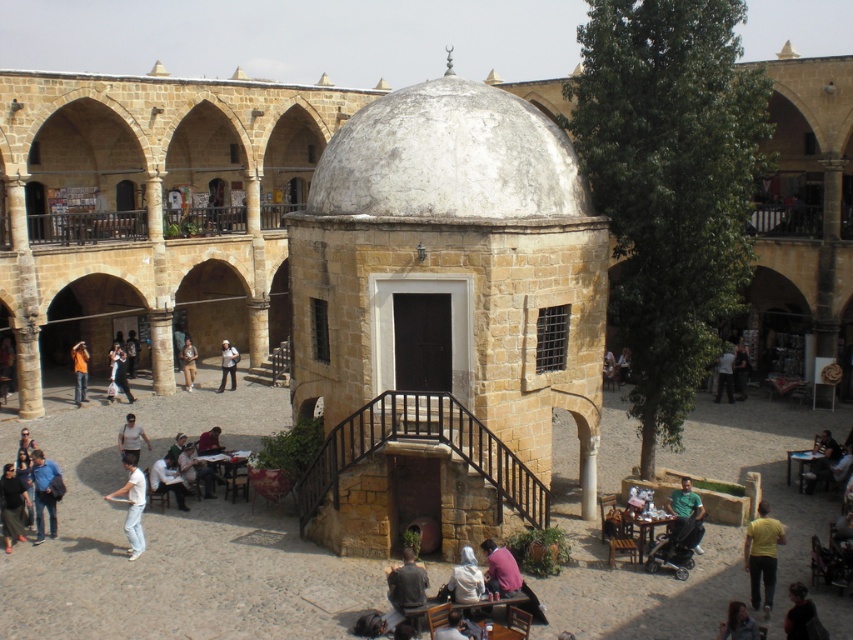
Does yellow matte shirt at lower right appear on the left side of dark gray leather jacket at center?

Incorrect, yellow matte shirt at lower right is not on the left side of dark gray leather jacket at center.

Is point (764, 602) in front of point (415, 563)?

Yes.

Who is more distant from viewer, (775, 570) or (395, 600)?

The point (775, 570) is more distant.

Locate an element on the screen. Image resolution: width=853 pixels, height=640 pixels. yellow matte shirt at lower right is located at coordinates (762, 556).

Consider the image. Measure the distance between dark blue jeans at lower left and dark brown fur coat at lower right.

The distance of dark blue jeans at lower left from dark brown fur coat at lower right is 104.31 feet.

Which is below, dark blue jeans at lower left or dark brown fur coat at lower right?

dark brown fur coat at lower right

Who is more distant from viewer, [4,536] or [799,611]?

Positioned behind is point [4,536].

Where is `dark blue jeans at lower left`? The width and height of the screenshot is (853, 640). dark blue jeans at lower left is located at coordinates (10, 506).

Is point (492, 572) positioned in front of point (227, 358)?

Yes, it is.

Does pink fabric shirt at lower center have a lesser height compared to white fabric shirt at center?

Yes, pink fabric shirt at lower center is shorter than white fabric shirt at center.

I want to click on pink fabric shirt at lower center, so click(500, 570).